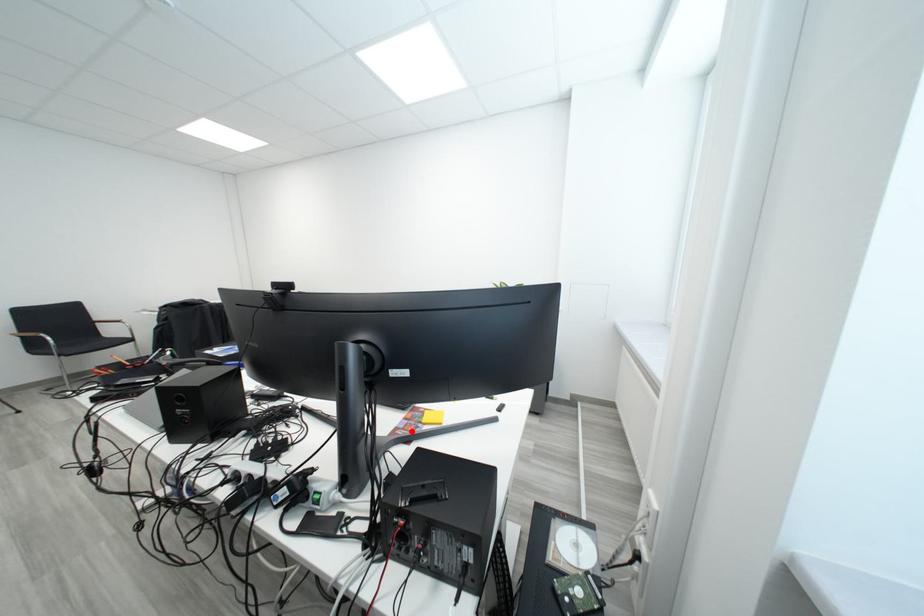
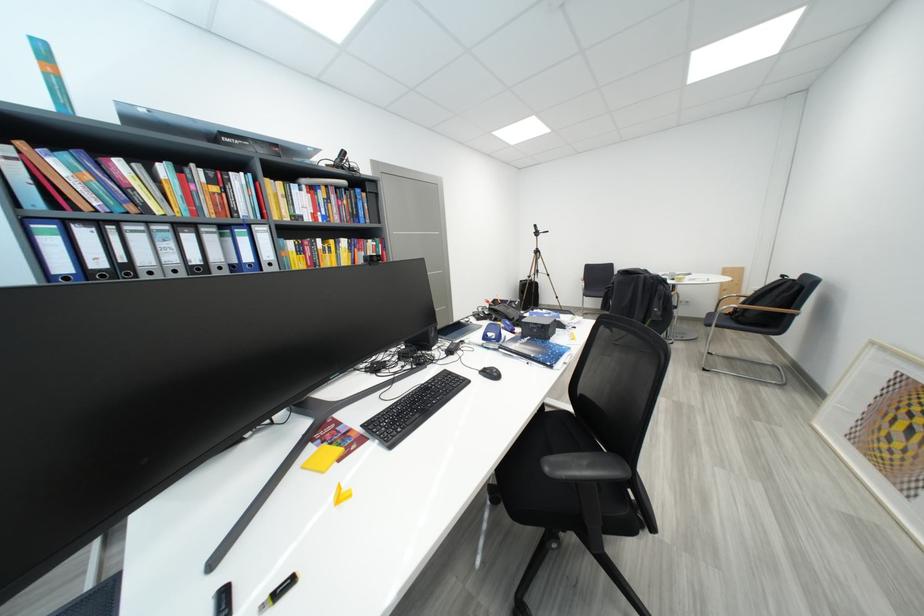
Question: I am providing you with two images of the same scene from different viewpoints. A red point is marked on the first image. Is the red point's position out of view in image 2?

Choices:
 (A) Yes
 (B) No

Answer: (B)